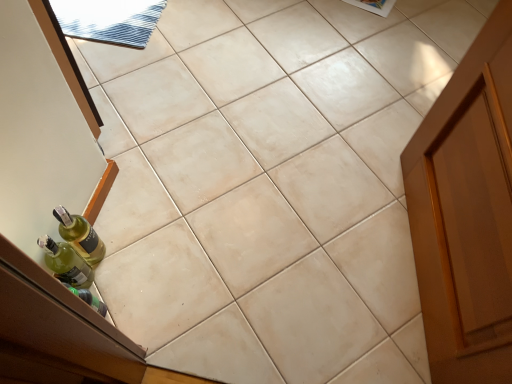
Question: Is green glass bottle at lower left, which is counted as the second bottle, starting from the bottom, wider or thinner than green glass bottle at left, marked as the 2th bottle in a top-to-bottom arrangement?

Choices:
 (A) wide
 (B) thin

Answer: (A)

Question: From a real-world perspective, relative to green glass bottle at left, the first bottle in the bottom-to-top sequence, is green glass bottle at lower left, which is counted as the second bottle, starting from the bottom, vertically above or below?

Choices:
 (A) above
 (B) below

Answer: (B)

Question: Looking at the image, does green glass bottle at lower left, which is counted as the second bottle, starting from the bottom, seem bigger or smaller compared to green glass bottle at left, the first bottle in the bottom-to-top sequence?

Choices:
 (A) small
 (B) big

Answer: (B)

Question: Looking at their shapes, would you say green glass bottle at left, the first bottle in the bottom-to-top sequence, is wider or thinner than green glass bottle at lower left, which is counted as the second bottle, starting from the bottom?

Choices:
 (A) thin
 (B) wide

Answer: (A)

Question: Looking at the image, does green glass bottle at left, marked as the 2th bottle in a top-to-bottom arrangement, seem bigger or smaller compared to green glass bottle at lower left, the first bottle viewed from the top?

Choices:
 (A) big
 (B) small

Answer: (B)

Question: From a real-world perspective, is green glass bottle at left, the first bottle in the bottom-to-top sequence, above or below green glass bottle at lower left, which is counted as the second bottle, starting from the bottom?

Choices:
 (A) below
 (B) above

Answer: (B)

Question: From the image's perspective, is green glass bottle at left, marked as the 2th bottle in a top-to-bottom arrangement, located above or below green glass bottle at lower left, the first bottle viewed from the top?

Choices:
 (A) above
 (B) below

Answer: (B)